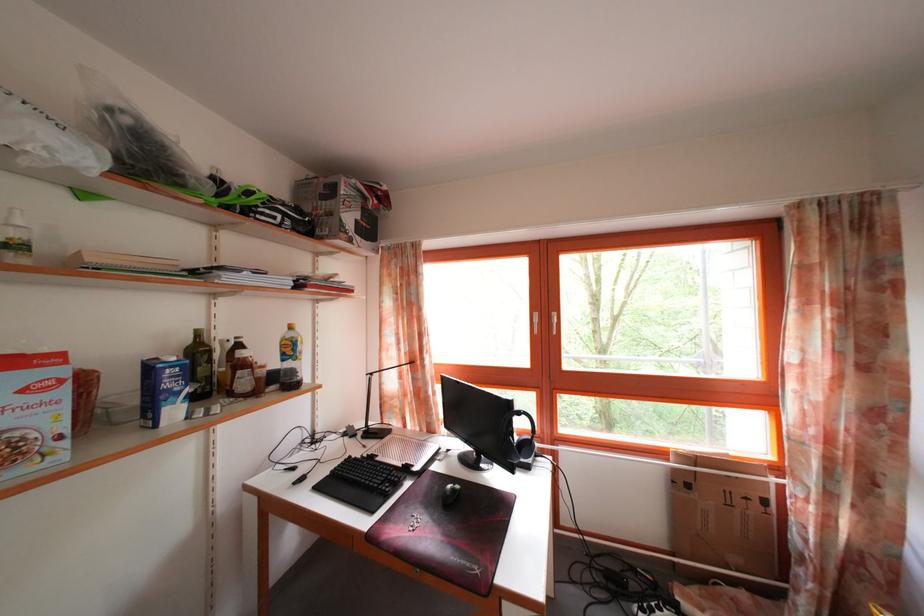
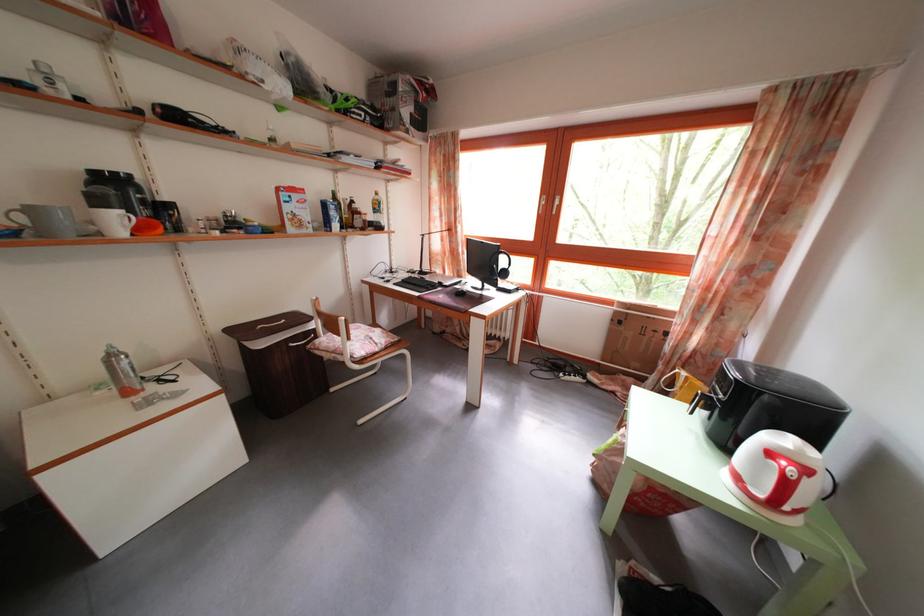
The point at [176,379] is marked in the first image. Where is the corresponding point in the second image?

(338, 214)